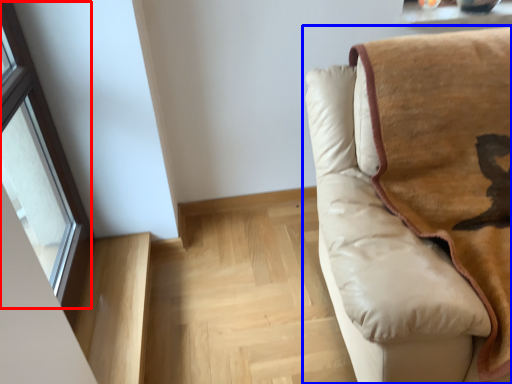
Question: Among these objects, which one is nearest to the camera, window (highlighted by a red box) or studio couch (highlighted by a blue box)?

Choices:
 (A) window
 (B) studio couch

Answer: (B)